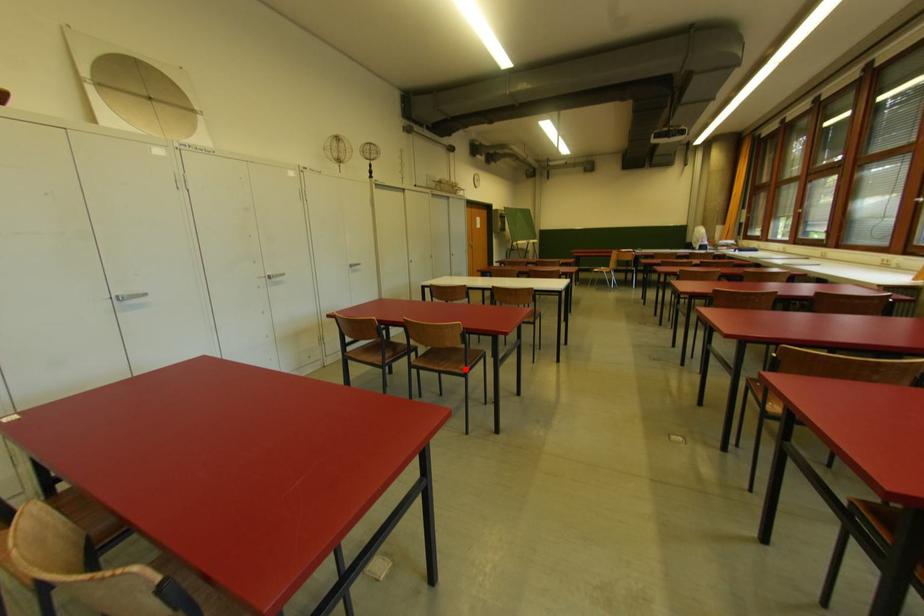
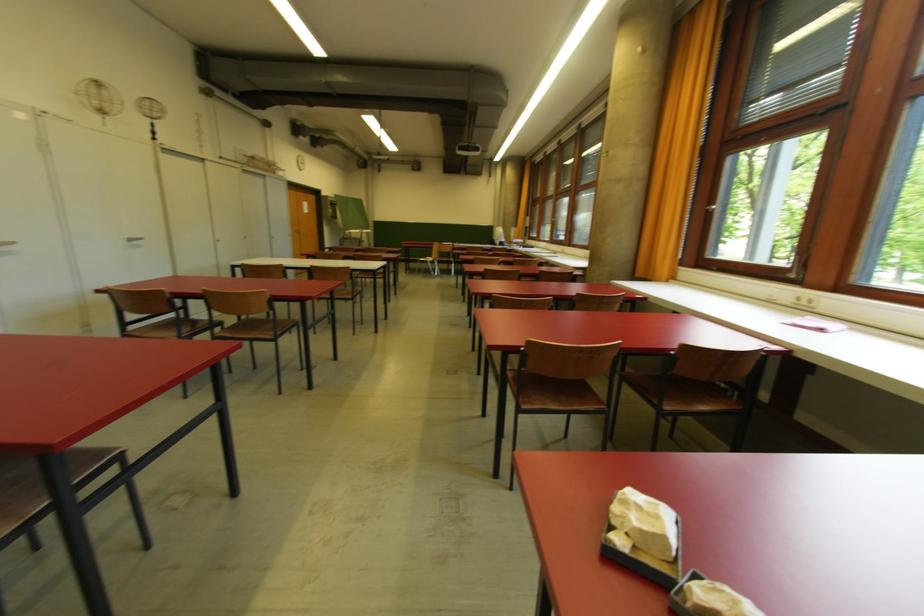
Question: I am providing you with two images of the same scene from different viewpoints. A red point is marked on the first image. Is the red point's position out of view in image 2?

Choices:
 (A) Yes
 (B) No

Answer: (B)